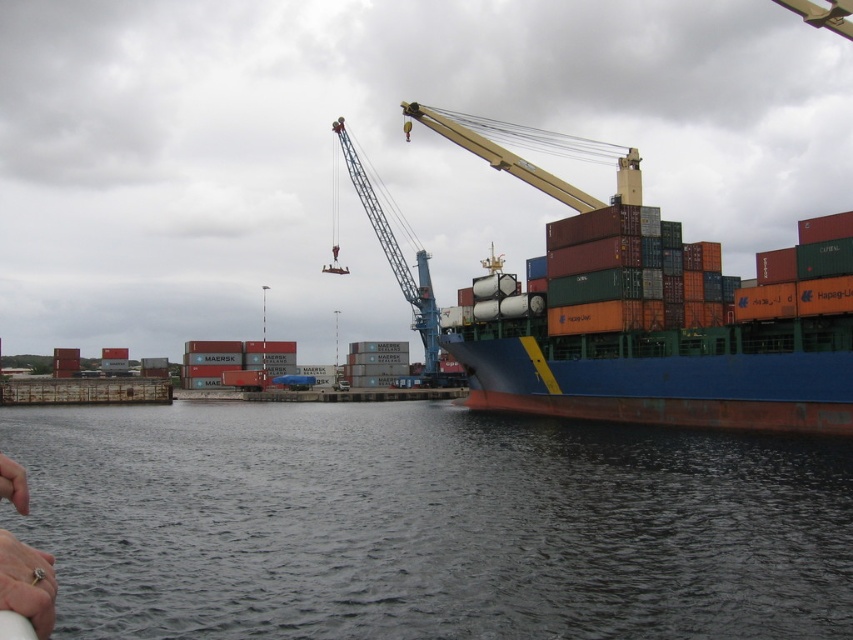
You are a port authority inspector checking the port layout. You need to ensure that the blue matte container ship at center can safely dock without blocking the entrance. Given that the silver metallic ring at lower left is part of the dock structure, does the size difference between them pose a risk?

The blue matte container ship at center is larger than the silver metallic ring at lower left. Since the ship is bigger, it should be able to dock without obstructing the entrance as long as it aligns properly with the dock structure.

Based on the photo, you are standing at the port and want to walk from the point at coordinates (695, 552) to the point at (784, 406). Which direction should you move relative to the cargo ship?

You should move towards the cargo ship because point (695, 552) is in front of point (784, 406) relative to the cargo ship.